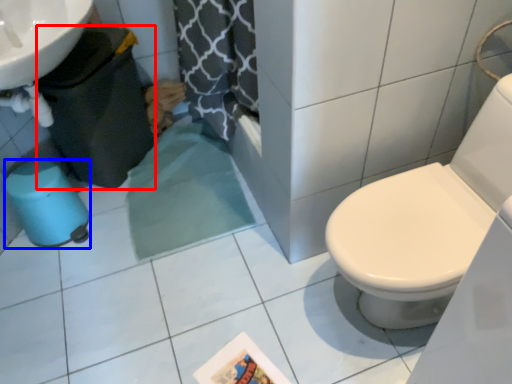
Question: Which point is further to the camera, potty (highlighted by a red box) or potty (highlighted by a blue box)?

Choices:
 (A) potty
 (B) potty

Answer: (B)